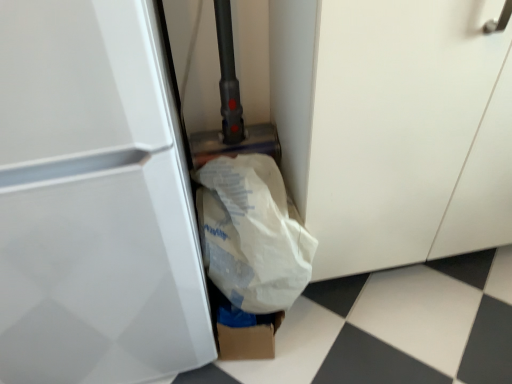
The width and height of the screenshot is (512, 384). In order to click on white paper bag at center in this screenshot , I will do `click(252, 234)`.

Describe the element at coordinates (252, 234) in the screenshot. This screenshot has height=384, width=512. I see `white paper bag at center` at that location.

Where is `white paper bag at center`? The width and height of the screenshot is (512, 384). white paper bag at center is located at coordinates (252, 234).